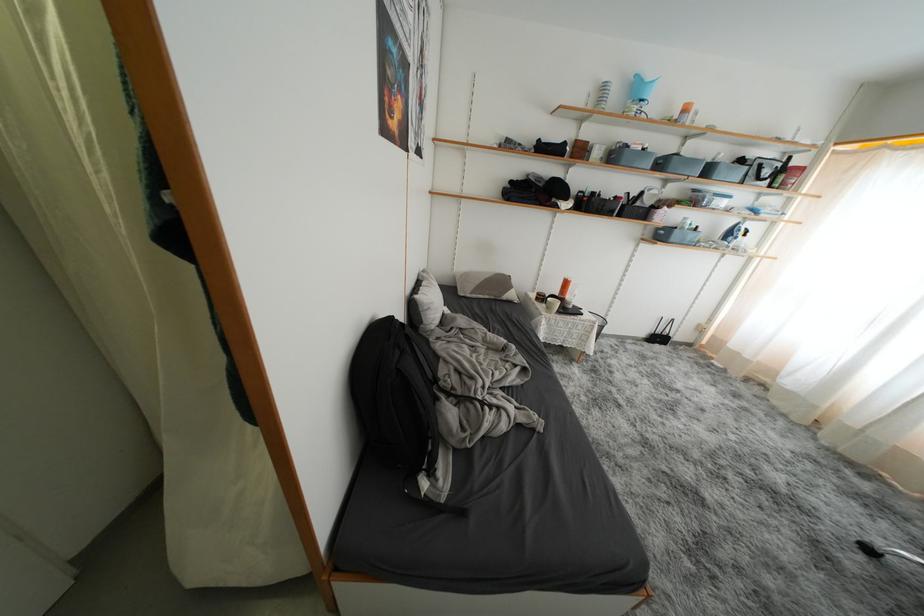
Describe the element at coordinates (421, 398) in the screenshot. I see `the bag handle` at that location.